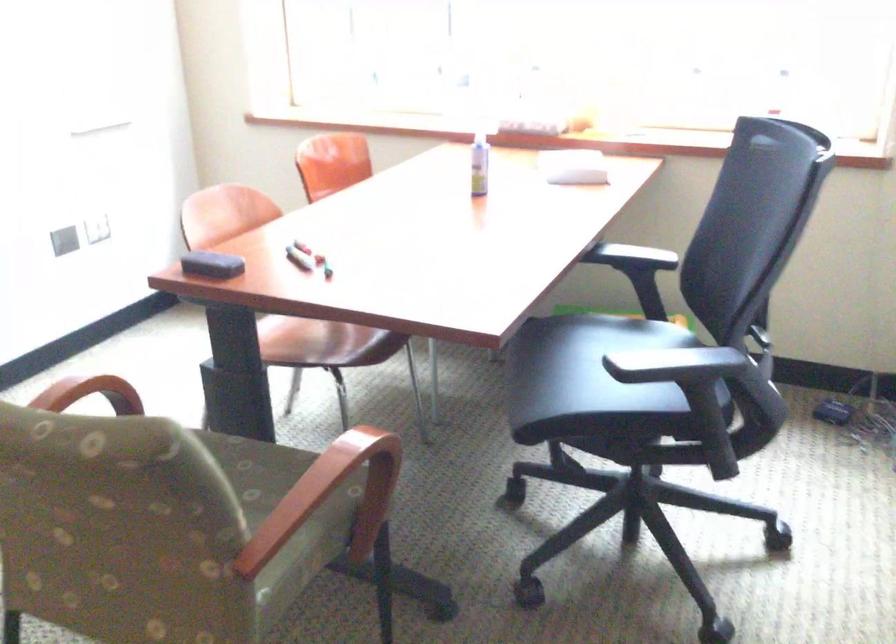
You are a GUI agent. You are given a task and a screenshot of the screen. Output one action in this format:
    pyautogui.click(x=<x>, y=<y>)
    Task: Click on the black board eraser
    
    Given the screenshot: What is the action you would take?
    pyautogui.click(x=211, y=265)